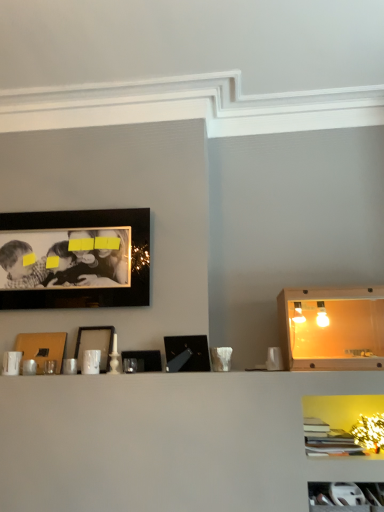
Question: Is matte brown picture frame at center-left, the first picture frame from the left, not inside black matte picture frame at center, which is the 4th picture frame from left to right?

Choices:
 (A) yes
 (B) no

Answer: (A)

Question: Is matte brown picture frame at center-left, which ranks as the 5th picture frame in right-to-left order, thinner than black matte picture frame at center, which is counted as the 2th picture frame, starting from the right?

Choices:
 (A) yes
 (B) no

Answer: (B)

Question: From a real-world perspective, is matte brown picture frame at center-left, the first picture frame from the left, located beneath black matte picture frame at center, which is the 4th picture frame from left to right?

Choices:
 (A) yes
 (B) no

Answer: (B)

Question: From the image's perspective, is matte brown picture frame at center-left, which ranks as the 5th picture frame in right-to-left order, below black matte picture frame at center, which is counted as the 2th picture frame, starting from the right?

Choices:
 (A) no
 (B) yes

Answer: (A)

Question: Considering the relative sizes of matte brown picture frame at center-left, which ranks as the 5th picture frame in right-to-left order, and black matte picture frame at center, which is counted as the 2th picture frame, starting from the right, in the image provided, is matte brown picture frame at center-left, which ranks as the 5th picture frame in right-to-left order, wider than black matte picture frame at center, which is counted as the 2th picture frame, starting from the right,?

Choices:
 (A) yes
 (B) no

Answer: (A)

Question: Based on their positions, is matte brown picture frame at center-left, which ranks as the 5th picture frame in right-to-left order, located to the left or right of black matte picture frame at center, which is the 4th picture frame from left to right?

Choices:
 (A) right
 (B) left

Answer: (B)

Question: Is matte brown picture frame at center-left, which ranks as the 5th picture frame in right-to-left order, inside or outside of black matte picture frame at center, which is counted as the 2th picture frame, starting from the right?

Choices:
 (A) outside
 (B) inside

Answer: (A)

Question: Considering their positions, is matte brown picture frame at center-left, which ranks as the 5th picture frame in right-to-left order, located in front of or behind black matte picture frame at center, which is the 4th picture frame from left to right?

Choices:
 (A) behind
 (B) front

Answer: (A)

Question: From a real-world perspective, is matte brown picture frame at center-left, the first picture frame from the left, physically located above or below black matte picture frame at center, which is counted as the 2th picture frame, starting from the right?

Choices:
 (A) above
 (B) below

Answer: (A)

Question: Looking at their shapes, would you say matte black picture frame at center, which is the third picture frame in right-to-left order, is wider or thinner than black matte picture frame at upper left, marked as the fourth picture frame in a right-to-left arrangement?

Choices:
 (A) wide
 (B) thin

Answer: (A)

Question: Do you think matte black picture frame at center, arranged as the third picture frame when viewed from the left, is within black matte picture frame at upper left, marked as the fourth picture frame in a right-to-left arrangement, or outside of it?

Choices:
 (A) outside
 (B) inside

Answer: (A)

Question: Is point (82, 328) closer or farther from the camera than point (117, 296)?

Choices:
 (A) closer
 (B) farther

Answer: (A)

Question: From a real-world perspective, is matte black picture frame at center, which is the third picture frame in right-to-left order, positioned above or below black matte picture frame at upper left, which is the 2th picture frame in left-to-right order?

Choices:
 (A) below
 (B) above

Answer: (A)

Question: Considering the positions of point (314, 506) and point (43, 333), is point (314, 506) closer or farther from the camera than point (43, 333)?

Choices:
 (A) farther
 (B) closer

Answer: (B)

Question: Considering the positions of white plastic cabinet at lower right, arranged as the 2th cabinet when viewed from the top, and matte brown picture frame at center-left, the first picture frame from the left, in the image, is white plastic cabinet at lower right, arranged as the 2th cabinet when viewed from the top, taller or shorter than matte brown picture frame at center-left, the first picture frame from the left,?

Choices:
 (A) tall
 (B) short

Answer: (B)